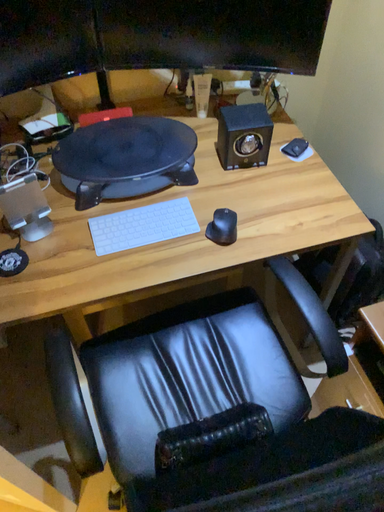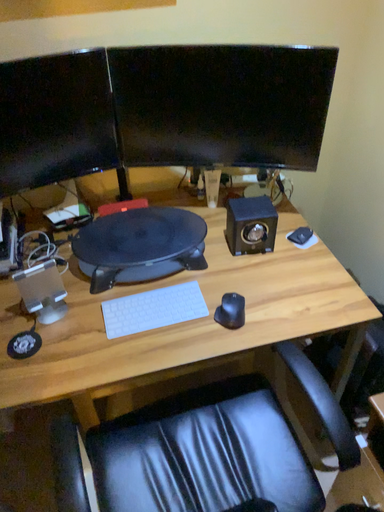
Question: Which way did the camera rotate in the video?

Choices:
 (A) rotated downward
 (B) rotated upward

Answer: (B)